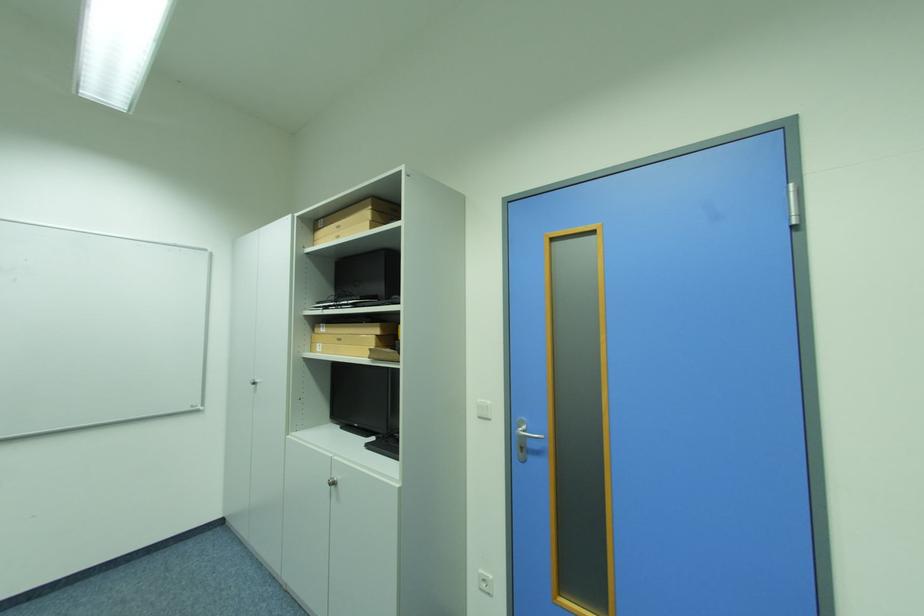
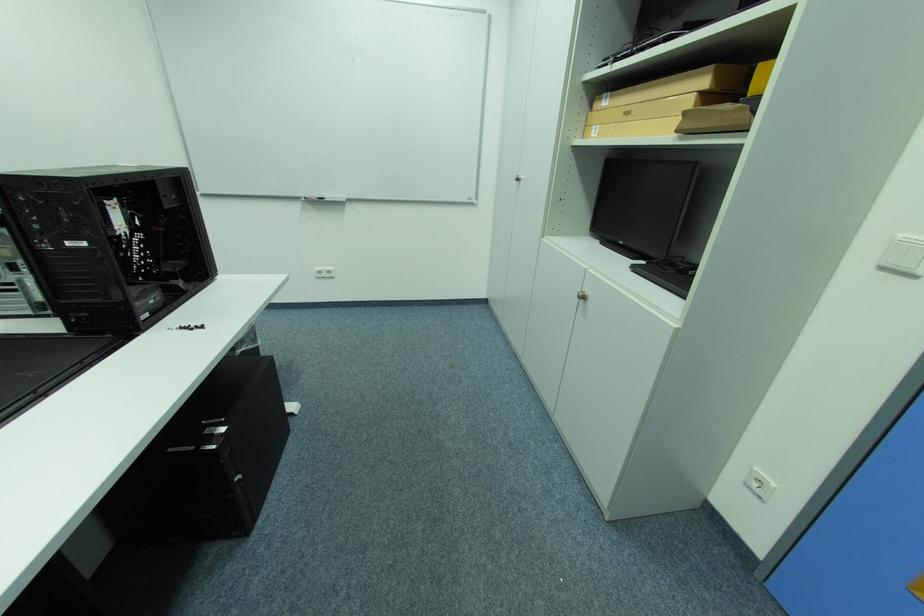
The point at (331, 328) is marked in the first image. Where is the corresponding point in the second image?

(614, 98)